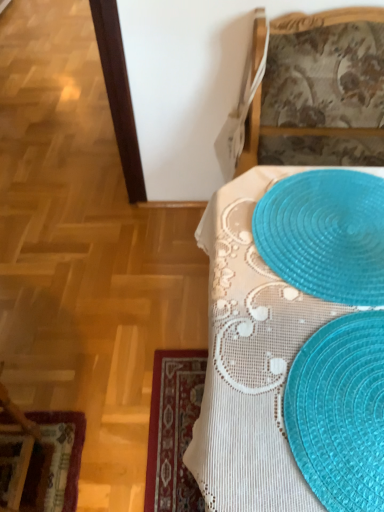
I want to click on free space between translucent plastic placemat at upper right and translucent blue placemat at lower right, so click(x=284, y=362).